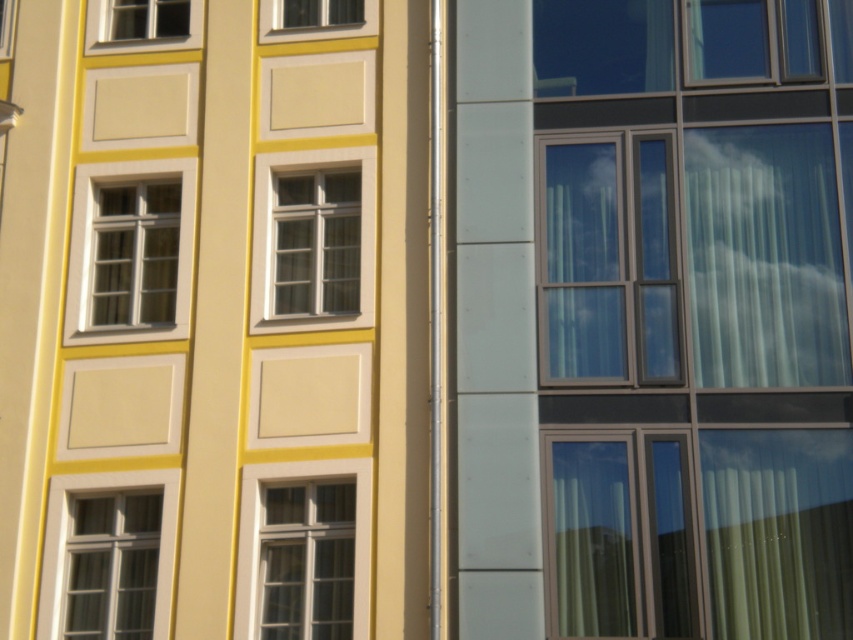
In the scene shown: Which is below, transparent glass window at center or matte glass window at upper left?

Positioned lower is transparent glass window at center.

Does transparent glass window at center have a greater height compared to matte glass window at upper left?

Yes, transparent glass window at center is taller than matte glass window at upper left.

Is point (578, 376) positioned before point (7, 35)?

Yes, point (578, 376) is in front of point (7, 35).

The height and width of the screenshot is (640, 853). I want to click on transparent glass window at center, so click(608, 260).

Is matte white window at upper left bigger than matte glass window at upper left?

Correct, matte white window at upper left is larger in size than matte glass window at upper left.

At what (x,y) coordinates should I click in order to perform the action: click on matte white window at upper left. Please return your answer as a coordinate pair (x, y). The image size is (853, 640). Looking at the image, I should click on (144, 20).

Locate an element on the screen. This screenshot has width=853, height=640. matte white window at upper left is located at coordinates (144, 20).

The image size is (853, 640). I want to click on matte white window at upper left, so click(x=144, y=20).

Who is lower down, matte white window at lower left or matte white window at upper left?

matte white window at lower left is below.

Who is more forward, (126, 568) or (143, 6)?

Point (126, 568) is more forward.

Locate an element on the screen. The height and width of the screenshot is (640, 853). matte white window at lower left is located at coordinates (112, 564).